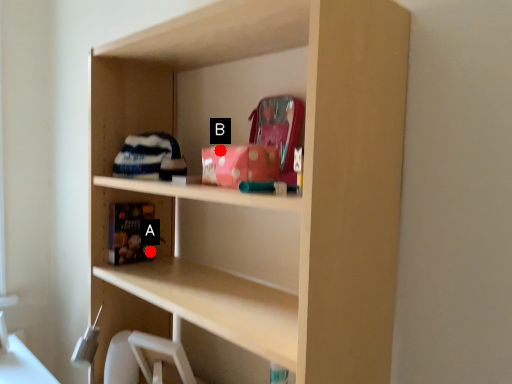
Question: Two points are circled on the image, labeled by A and B beside each circle. Among these points, which one is farthest from the camera?

Choices:
 (A) A is further
 (B) B is further

Answer: (A)